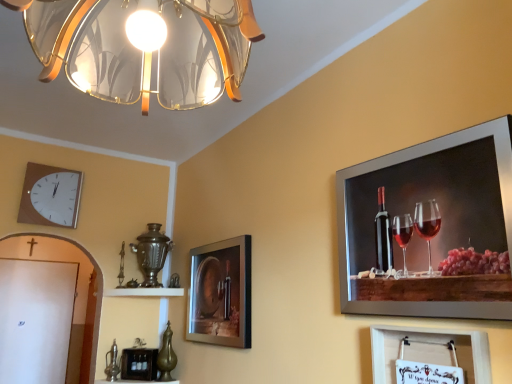
Describe the element at coordinates (139, 364) in the screenshot. The width and height of the screenshot is (512, 384). I see `wooden picture frame at lower center, marked as the 1th picture frame in a left-to-right arrangement` at that location.

Locate an element on the screen. The height and width of the screenshot is (384, 512). white wooden clock at upper left is located at coordinates (50, 196).

Where is `matte glass picture frame at center, arranged as the second picture frame when viewed from the left`? The height and width of the screenshot is (384, 512). matte glass picture frame at center, arranged as the second picture frame when viewed from the left is located at coordinates (221, 293).

Locate an element on the screen. This screenshot has height=384, width=512. translucent glass lampshade at upper center is located at coordinates (141, 46).

Considering the sizes of objects white paper at lower right, arranged as the 3th picture frame when viewed from the back, and metallic silver picture frame at upper right, the third picture frame viewed from the left, in the image provided, who is taller, white paper at lower right, arranged as the 3th picture frame when viewed from the back, or metallic silver picture frame at upper right, the third picture frame viewed from the left,?

metallic silver picture frame at upper right, the third picture frame viewed from the left, is taller.

From the picture: Between white paper at lower right, the 1th picture frame positioned from the right, and metallic silver picture frame at upper right, the third picture frame viewed from the left, which one has larger size?

metallic silver picture frame at upper right, the third picture frame viewed from the left.

Is white paper at lower right, acting as the 2th picture frame starting from the front, outside of metallic silver picture frame at upper right, acting as the 4th picture frame starting from the back?

white paper at lower right, acting as the 2th picture frame starting from the front, lies outside metallic silver picture frame at upper right, acting as the 4th picture frame starting from the back,'s area.

Looking at their sizes, would you say white paper at lower right, acting as the 2th picture frame starting from the front, is wider or thinner than metallic silver picture frame at upper right, marked as the first picture frame in a front-to-back arrangement?

In the image, white paper at lower right, acting as the 2th picture frame starting from the front, appears to be wider than metallic silver picture frame at upper right, marked as the first picture frame in a front-to-back arrangement.

In terms of width, does white glossy shelf at center look wider or thinner when compared to metallic silver picture frame at upper right, the third picture frame viewed from the left?

In the image, white glossy shelf at center appears to be wider than metallic silver picture frame at upper right, the third picture frame viewed from the left.

Locate an element on the screen. The image size is (512, 384). shelf on the left of the metallic silver picture frame at upper right, the third picture frame viewed from the left is located at coordinates click(144, 292).

From the image's perspective, does white glossy shelf at center appear lower than metallic silver picture frame at upper right, marked as the first picture frame in a front-to-back arrangement?

Yes, from the image's perspective, white glossy shelf at center is below metallic silver picture frame at upper right, marked as the first picture frame in a front-to-back arrangement.

Is the surface of white glossy shelf at center in direct contact with metallic silver picture frame at upper right, which ranks as the second picture frame in right-to-left order?

white glossy shelf at center and metallic silver picture frame at upper right, which ranks as the second picture frame in right-to-left order, are clearly separated.

Which object is more forward, white paper at lower right, the 1th picture frame positioned from the right, or translucent glass lampshade at upper center?

Positioned in front is translucent glass lampshade at upper center.

Is white paper at lower right, acting as the 2th picture frame starting from the front, turned away from translucent glass lampshade at upper center?

No, white paper at lower right, acting as the 2th picture frame starting from the front,'s orientation is not away from translucent glass lampshade at upper center.

Based on the photo, between white paper at lower right, which is counted as the 4th picture frame, starting from the left, and translucent glass lampshade at upper center, which one appears on the left side from the viewer's perspective?

translucent glass lampshade at upper center.

From a real-world perspective, is white paper at lower right, the 1th picture frame positioned from the right, below translucent glass lampshade at upper center?

Yes.

Is white wooden clock at upper left facing towards wooden picture frame at lower center, marked as the 1th picture frame in a left-to-right arrangement?

No, white wooden clock at upper left is not oriented towards wooden picture frame at lower center, marked as the 1th picture frame in a left-to-right arrangement.

From the image's perspective, which is below, white wooden clock at upper left or wooden picture frame at lower center, the fourth picture frame when ordered from front to back?

wooden picture frame at lower center, the fourth picture frame when ordered from front to back, appears lower in the image.

Considering the sizes of objects white wooden clock at upper left and wooden picture frame at lower center, the 4th picture frame in the right-to-left sequence, in the image provided, who is thinner, white wooden clock at upper left or wooden picture frame at lower center, the 4th picture frame in the right-to-left sequence,?

white wooden clock at upper left.

How many degrees apart are the facing directions of white wooden clock at upper left and wooden picture frame at lower center, the 1th picture frame when ordered from back to front?

47.9 degrees.

Is white glossy shelf at center oriented towards matte glass picture frame at center, which is the third picture frame in front-to-back order?

Yes, white glossy shelf at center is facing matte glass picture frame at center, which is the third picture frame in front-to-back order.

Which object is closer to the camera taking this photo, white glossy shelf at center or matte glass picture frame at center, arranged as the 2th picture frame when viewed from the back?

matte glass picture frame at center, arranged as the 2th picture frame when viewed from the back.

From the image's perspective, does matte glass picture frame at center, the third picture frame when ordered from right to left, appear lower than white glossy shelf at center?

No, from the image's perspective, matte glass picture frame at center, the third picture frame when ordered from right to left, is not beneath white glossy shelf at center.

Is matte glass picture frame at center, arranged as the 2th picture frame when viewed from the back, to the right of white glossy shelf at center from the viewer's perspective?

Indeed, matte glass picture frame at center, arranged as the 2th picture frame when viewed from the back, is positioned on the right side of white glossy shelf at center.

Is point (239, 265) closer or farther from the camera than point (170, 296)?

Point (239, 265) is closer to the camera than point (170, 296).

Could you tell me if matte glass picture frame at center, which is the third picture frame in front-to-back order, is turned towards white glossy shelf at center?

No, matte glass picture frame at center, which is the third picture frame in front-to-back order, is not turned towards white glossy shelf at center.

Locate an element on the screen. Image resolution: width=512 pixels, height=384 pixels. picture frame that is the 3rd one when counting forward from the wooden picture frame at lower center, marked as the 1th picture frame in a left-to-right arrangement is located at coordinates (432, 227).

Is wooden picture frame at lower center, the 1th picture frame when ordered from back to front, not within metallic silver picture frame at upper right, which ranks as the second picture frame in right-to-left order?

Yes, wooden picture frame at lower center, the 1th picture frame when ordered from back to front, is outside of metallic silver picture frame at upper right, which ranks as the second picture frame in right-to-left order.

Considering their positions, is wooden picture frame at lower center, the 4th picture frame in the right-to-left sequence, located in front of or behind metallic silver picture frame at upper right, the third picture frame viewed from the left?

wooden picture frame at lower center, the 4th picture frame in the right-to-left sequence, is positioned farther from the viewer than metallic silver picture frame at upper right, the third picture frame viewed from the left.

Locate an element on the screen. This screenshot has height=384, width=512. picture frame in front of the white paper at lower right, which is counted as the 4th picture frame, starting from the left is located at coordinates (432, 227).

From the image's perspective, starting from the white glossy shelf at center, which picture frame is the 3rd one above? Please provide its 2D coordinates.

[(432, 227)]

Considering their positions, is translucent glass lampshade at upper center positioned further to white glossy shelf at center than wooden picture frame at lower center, the 1th picture frame when ordered from back to front?

Based on the image, translucent glass lampshade at upper center appears to be further to white glossy shelf at center.

Considering their positions, is white paper at lower right, the 1th picture frame positioned from the right, positioned further to white glossy shelf at center than matte glass picture frame at center, which is the third picture frame in front-to-back order?

Among the two, white paper at lower right, the 1th picture frame positioned from the right, is located further to white glossy shelf at center.

Estimate the real-world distances between objects in this image. Which object is further from wooden picture frame at lower center, the 4th picture frame in the right-to-left sequence, white glossy shelf at center or matte glass picture frame at center, arranged as the 2th picture frame when viewed from the back?

Based on the image, matte glass picture frame at center, arranged as the 2th picture frame when viewed from the back, appears to be further to wooden picture frame at lower center, the 4th picture frame in the right-to-left sequence.

From the image, which object appears to be farther from white wooden clock at upper left, matte glass picture frame at center, which is the third picture frame in front-to-back order, or white paper at lower right, the 1th picture frame positioned from the right?

Based on the image, white paper at lower right, the 1th picture frame positioned from the right, appears to be further to white wooden clock at upper left.

Considering their positions, is white wooden clock at upper left positioned closer to metallic silver picture frame at upper right, the third picture frame viewed from the left, than translucent glass lampshade at upper center?

translucent glass lampshade at upper center lies closer to metallic silver picture frame at upper right, the third picture frame viewed from the left, than the other object.

Which object lies nearer to the anchor point metallic silver picture frame at upper right, the third picture frame viewed from the left, matte glass picture frame at center, which is the third picture frame in front-to-back order, or white wooden clock at upper left?

matte glass picture frame at center, which is the third picture frame in front-to-back order, is positioned closer to the anchor metallic silver picture frame at upper right, the third picture frame viewed from the left.

Consider the image. Which object lies nearer to the anchor point white wooden clock at upper left, white glossy shelf at center or metallic silver picture frame at upper right, which ranks as the second picture frame in right-to-left order?

white glossy shelf at center.

Based on their spatial positions, is metallic silver picture frame at upper right, marked as the first picture frame in a front-to-back arrangement, or white wooden clock at upper left closer to matte glass picture frame at center, arranged as the 2th picture frame when viewed from the back?

The object closer to matte glass picture frame at center, arranged as the 2th picture frame when viewed from the back, is metallic silver picture frame at upper right, marked as the first picture frame in a front-to-back arrangement.

In order to click on wall clock positioned between translucent glass lampshade at upper center and wooden picture frame at lower center, the fourth picture frame when ordered from front to back, from near to far in this screenshot , I will do `click(50, 196)`.

Identify the location of picture frame between white paper at lower right, which is counted as the 4th picture frame, starting from the left, and white glossy shelf at center in the front-back direction. The width and height of the screenshot is (512, 384). (221, 293).

At what (x,y) coordinates should I click in order to perform the action: click on shelf between translucent glass lampshade at upper center and white wooden clock at upper left along the z-axis. Please return your answer as a coordinate pair (x, y). The image size is (512, 384). Looking at the image, I should click on pos(144,292).

Find the location of a particular element. shelf between matte glass picture frame at center, arranged as the 2th picture frame when viewed from the back, and wooden picture frame at lower center, the 4th picture frame in the right-to-left sequence, in the front-back direction is located at coordinates (144, 292).